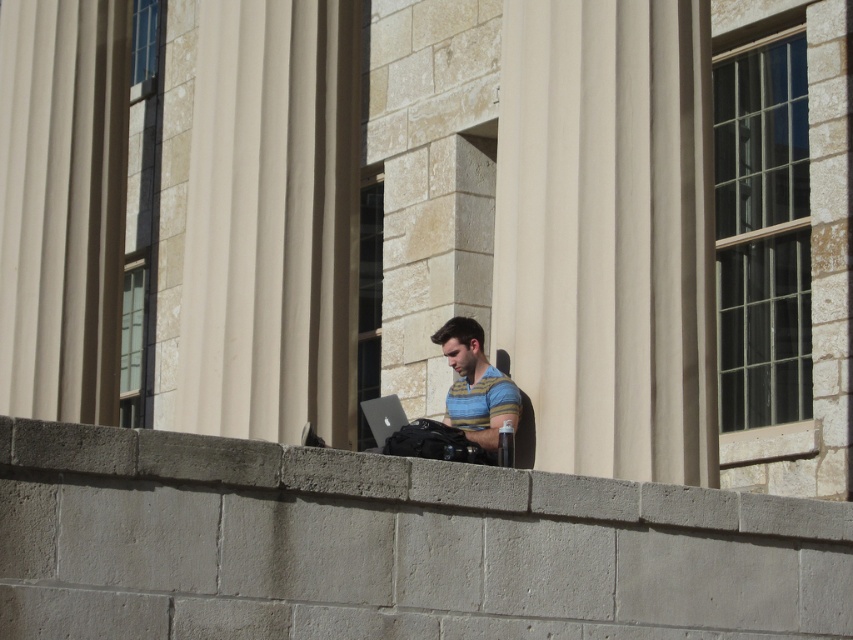
You are a photographer planning to take a portrait of the striped cotton shirt at center and the concrete ledge at center in the scene. Which object is wider?

The concrete ledge at center is wider than the striped cotton shirt at center.

You are a visitor at the classical building and want to place your backpack on the concrete ledge at center. However, there is a smooth stone pillar at center in the way. Can you easily move around the pillar to access the ledge?

The concrete ledge at center is behind the smooth stone pillar at center, so you would need to go around the pillar to reach it. Since pillars typically have space around them, you can move around either side to access the ledge.